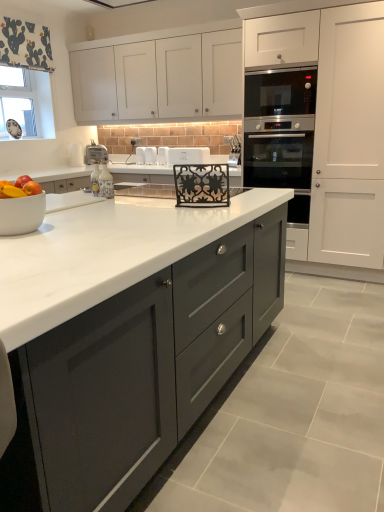
Question: Based on their positions, is white matte oven at upper right, marked as the 3th cabinetry in a left-to-right arrangement, located to the left or right of stainless steel oven at right?

Choices:
 (A) right
 (B) left

Answer: (A)

Question: From their relative heights in the image, would you say white matte oven at upper right, positioned as the first cabinetry in right-to-left order, is taller or shorter than stainless steel oven at right?

Choices:
 (A) short
 (B) tall

Answer: (B)

Question: Considering the real-world distances, which object is farthest from the white plastic toaster at center, the 6th appliance viewed from the front?

Choices:
 (A) white plastic toaster at center, which is the eighth appliance in front-to-back order
 (B) white glossy toaster at center, which is counted as the 2th appliance, starting from the left
 (C) matte gray cabinets at center, which ranks as the 1th cabinetry in left-to-right order
 (D) metallic black decorative rack at center, which is the 8th appliance in back-to-front order
 (E) white glossy toaster at center, marked as the 5th appliance in a front-to-back arrangement

Answer: (C)

Question: Which object is the closest to the red matte apple at left?

Choices:
 (A) stainless steel oven at right
 (B) white plastic toaster at center, which appears as the eighth appliance when viewed from the right
 (C) satin black oven at center-right, positioned as the 5th appliance in back-to-front order
 (D) white plastic toaster at center, the 5th appliance from the right
 (E) white matte cabinet at upper center, arranged as the 2th cabinetry when viewed from the left

Answer: (B)